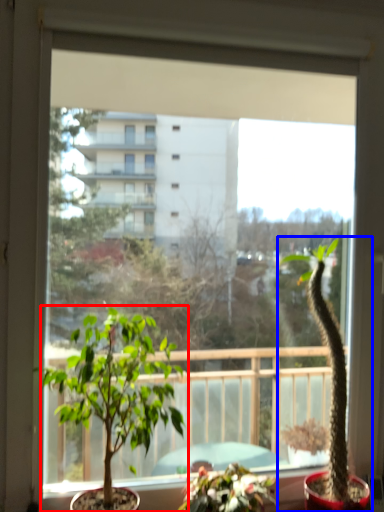
Question: Among these objects, which one is nearest to the camera, houseplant (highlighted by a red box) or houseplant (highlighted by a blue box)?

Choices:
 (A) houseplant
 (B) houseplant

Answer: (A)